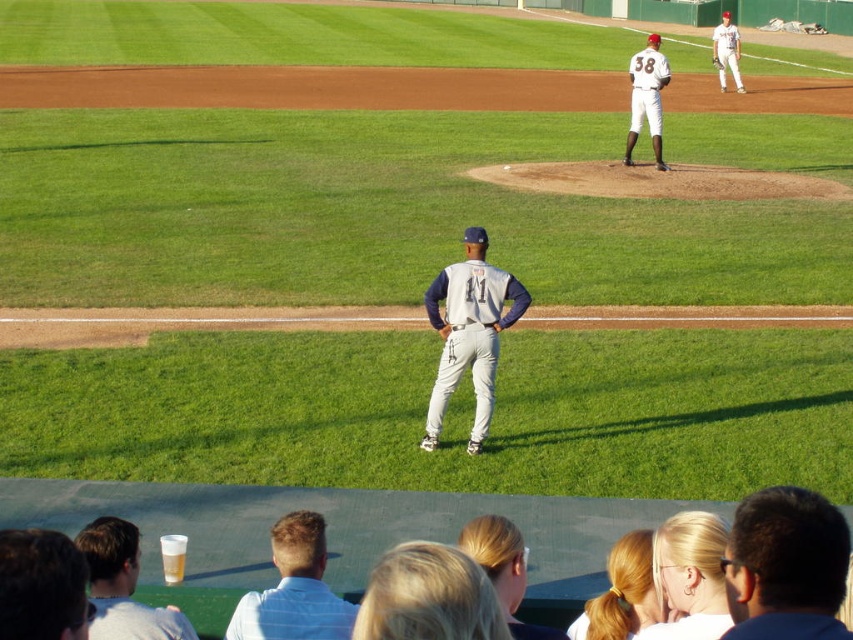
Question: Is white uniform at upper center smaller than white jersey at upper right?

Choices:
 (A) yes
 (B) no

Answer: (A)

Question: Can you confirm if light blue shirt at lower left is smaller than white jersey at upper right?

Choices:
 (A) no
 (B) yes

Answer: (B)

Question: Which point is farther to the camera?

Choices:
 (A) 268,630
 (B) 715,35
 (C) 44,588
 (D) 94,580

Answer: (B)

Question: Can you confirm if white shirt at center is smaller than white uniform at upper center?

Choices:
 (A) no
 (B) yes

Answer: (B)

Question: Which of the following is the farthest from the observer?

Choices:
 (A) (289, 547)
 (B) (24, 573)
 (C) (724, 64)
 (D) (142, 636)

Answer: (C)

Question: Considering the real-world distances, which object is closest to the gray matte uniform at center?

Choices:
 (A) white shirt at center
 (B) dark brown hair at center

Answer: (A)